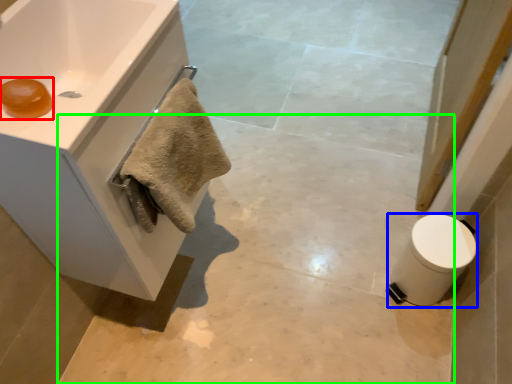
Question: Estimate the real-world distances between objects in this image. Which object is farther from soap (highlighted by a red box), toilet bowl (highlighted by a blue box) or concrete (highlighted by a green box)?

Choices:
 (A) toilet bowl
 (B) concrete

Answer: (A)